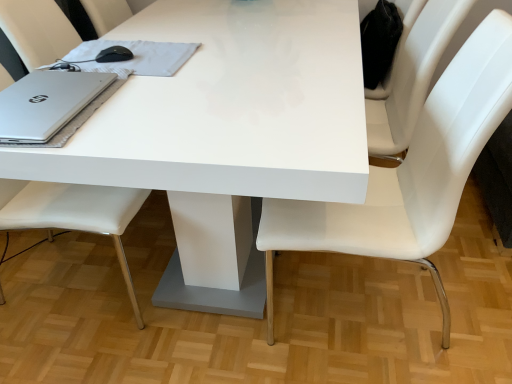
Where is `vacant region under white leather chair at center, positioned as the first chair in right-to-left order (from a real-world perspective)`? The image size is (512, 384). vacant region under white leather chair at center, positioned as the first chair in right-to-left order (from a real-world perspective) is located at coordinates point(381,311).